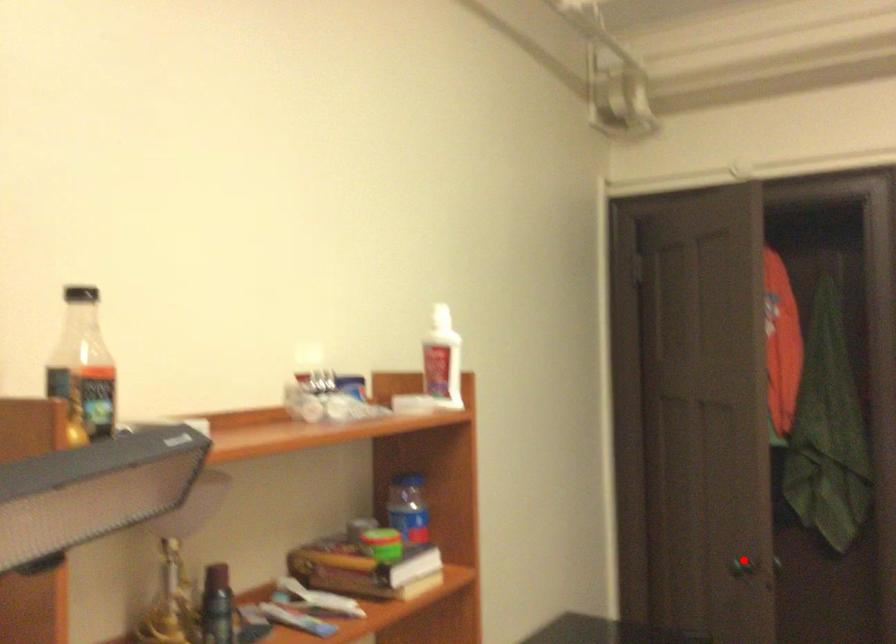
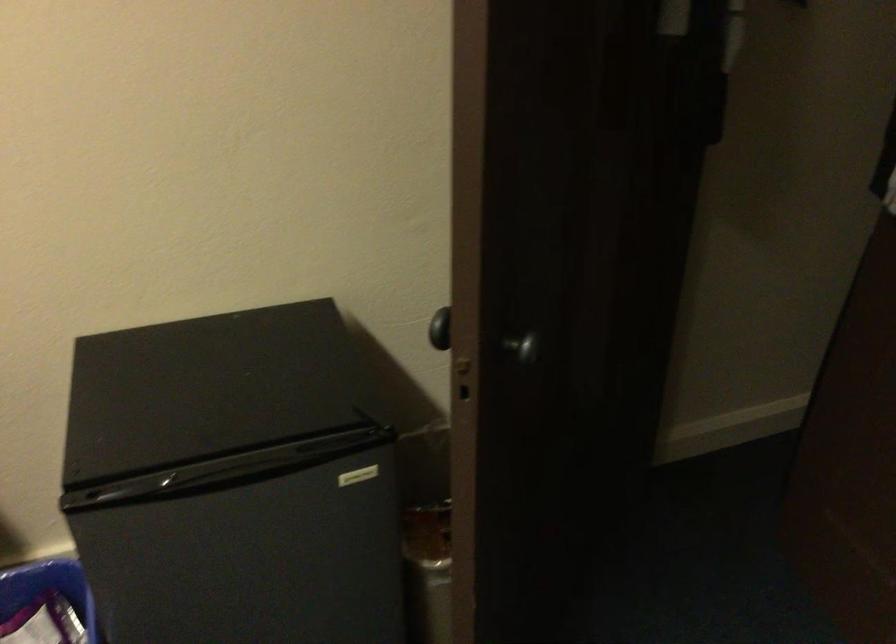
Question: A red point is marked in image1. In image2, is the corresponding 3D point closer to the camera or farther? Reply with the corresponding letter.

Choices:
 (A) The corresponding 3D point is closer.
 (B) The corresponding 3D point is farther.

Answer: (A)